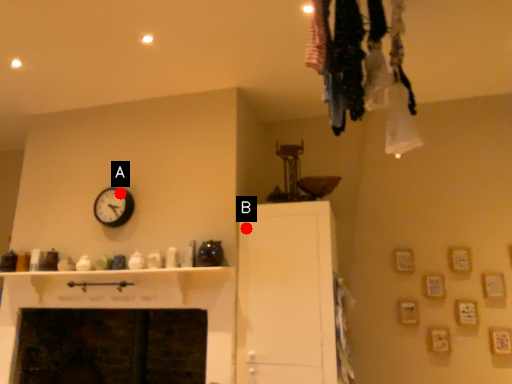
Question: Two points are circled on the image, labeled by A and B beside each circle. Which point is farther to the camera?

Choices:
 (A) A is further
 (B) B is further

Answer: (A)